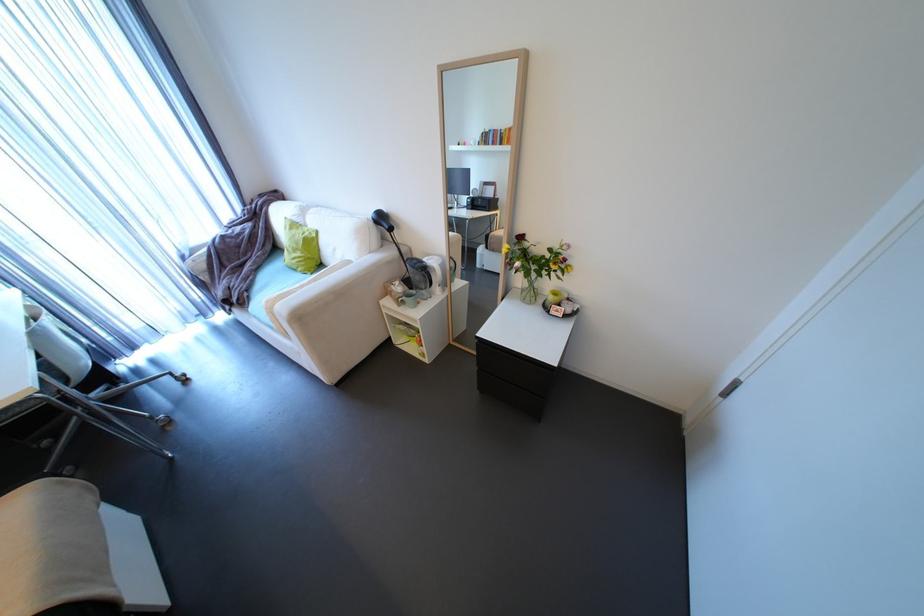
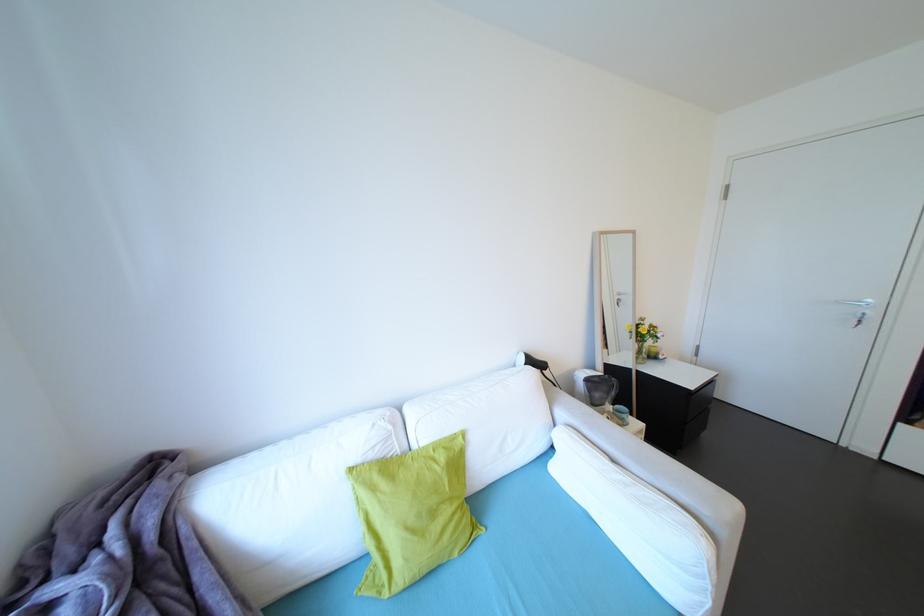
Where in the second image is the point corresponding to (317,233) from the first image?

(451, 448)